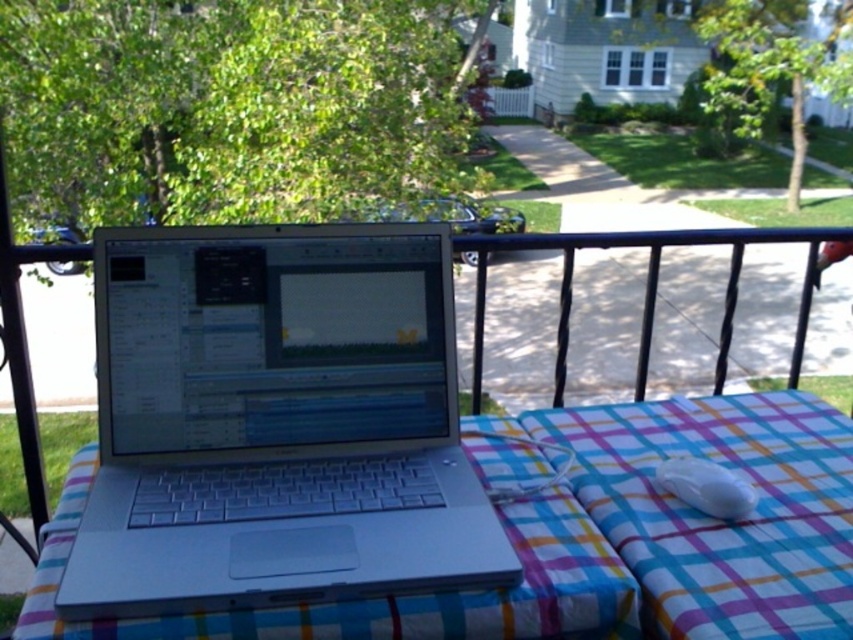
Which of these two, silver metallic laptop at center or plaid fabric at center, stands shorter?

With less height is plaid fabric at center.

Is point (201, 609) farther from camera compared to point (792, 449)?

That is False.

The image size is (853, 640). Identify the location of silver metallic laptop at center. (276, 422).

Who is positioned more to the right, silver metallic laptop at center or white glossy mouse at lower right?

Positioned to the right is white glossy mouse at lower right.

Who is positioned more to the left, silver metallic laptop at center or white glossy mouse at lower right?

Positioned to the left is silver metallic laptop at center.

Which is in front, point (206, 320) or point (733, 488)?

Point (733, 488) is in front.

Find the location of `silver metallic laptop at center`. silver metallic laptop at center is located at coordinates (276, 422).

Can you confirm if plaid fabric table at center is taller than white glossy mouse at lower right?

Yes, plaid fabric table at center is taller than white glossy mouse at lower right.

Locate an element on the screen. plaid fabric table at center is located at coordinates (607, 540).

Which is in front, point (595, 628) or point (697, 483)?

Point (595, 628) is more forward.

What are the coordinates of `plaid fabric table at center` in the screenshot? It's located at (607, 540).